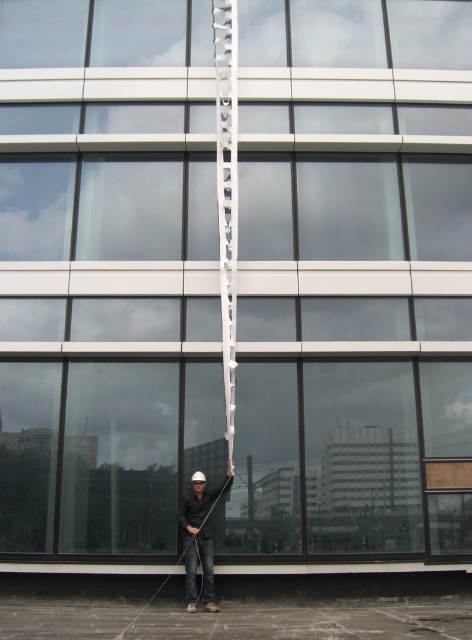
Question: Is matte black shirt at center below black matte rope at center?

Choices:
 (A) yes
 (B) no

Answer: (B)

Question: Among these objects, which one is nearest to the camera?

Choices:
 (A) matte black shirt at center
 (B) white metallic ladder at center
 (C) black matte rope at center

Answer: (C)

Question: Which object is closer to the camera taking this photo?

Choices:
 (A) white metallic ladder at center
 (B) black matte rope at center
 (C) matte black shirt at center

Answer: (B)

Question: Can you confirm if matte black shirt at center is positioned above black matte rope at center?

Choices:
 (A) yes
 (B) no

Answer: (A)

Question: Which of the following is the farthest from the observer?

Choices:
 (A) (236, 20)
 (B) (202, 483)

Answer: (A)

Question: Considering the relative positions of matte black shirt at center and black matte rope at center in the image provided, where is matte black shirt at center located with respect to black matte rope at center?

Choices:
 (A) left
 (B) right

Answer: (B)